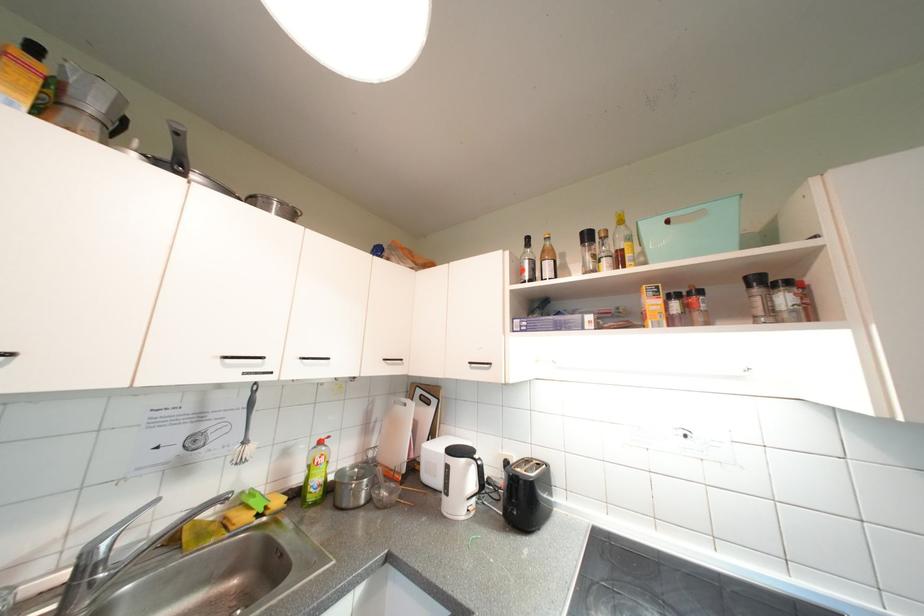
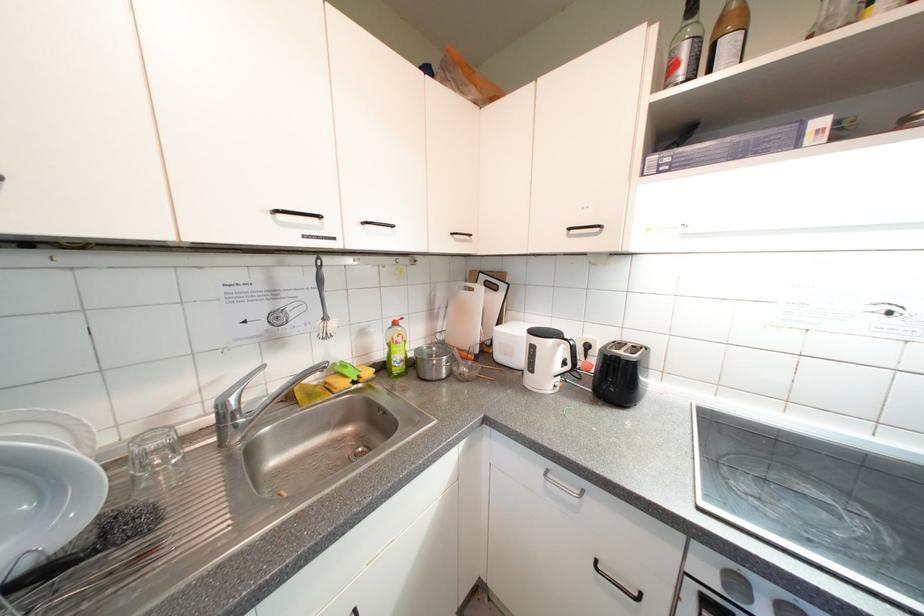
In the second image, find the point that corresponds to [92,572] in the first image.

(233, 419)